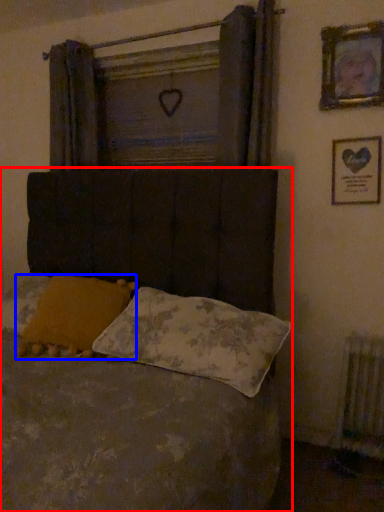
Question: Which object is closer to the camera taking this photo, bed (highlighted by a red box) or pillow (highlighted by a blue box)?

Choices:
 (A) bed
 (B) pillow

Answer: (A)